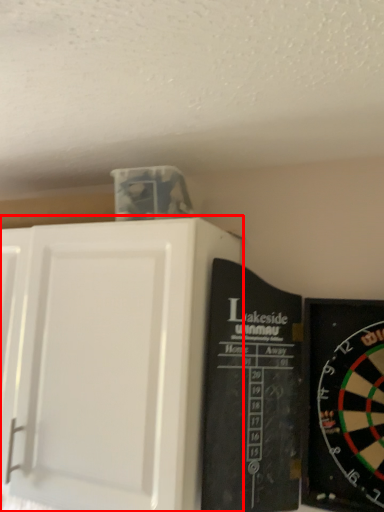
Question: From the image, what is the correct spatial relationship of cupboard (annotated by the red box) in relation to bulletin board?

Choices:
 (A) right
 (B) left

Answer: (B)